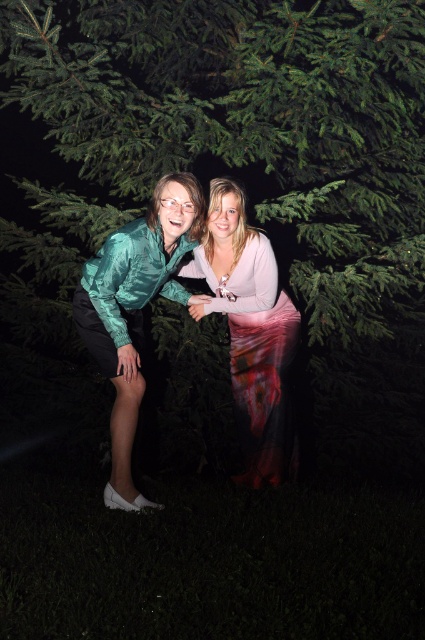
Question: Is green textured tree at center thinner than silky pink skirt at center?

Choices:
 (A) yes
 (B) no

Answer: (B)

Question: Can you confirm if green textured tree at center is positioned above blonde hair at center?

Choices:
 (A) yes
 (B) no

Answer: (A)

Question: Does green textured tree at center appear over silky pink skirt at center?

Choices:
 (A) yes
 (B) no

Answer: (A)

Question: Which point is closer to the camera?

Choices:
 (A) blonde hair at center
 (B) shiny teal blouse at center

Answer: (B)

Question: Which object appears farthest from the camera in this image?

Choices:
 (A) blonde hair at center
 (B) shiny teal blouse at left
 (C) green textured tree at center

Answer: (A)

Question: Which of the following is the farthest from the observer?

Choices:
 (A) blonde hair at center
 (B) silky pink skirt at center

Answer: (B)